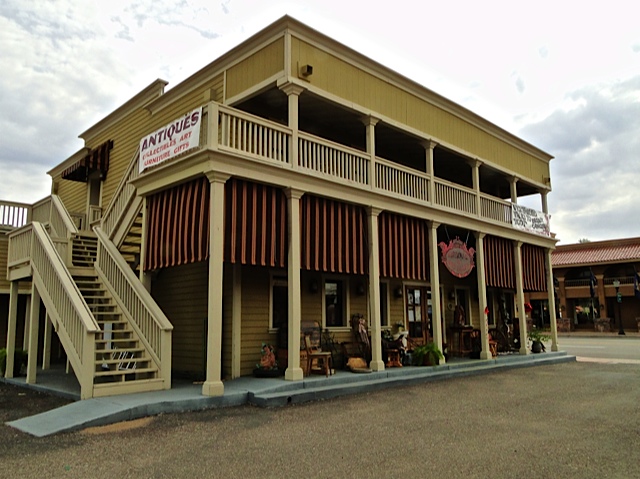
Where is `window`? This screenshot has width=640, height=479. window is located at coordinates (268, 311), (330, 309), (490, 314).